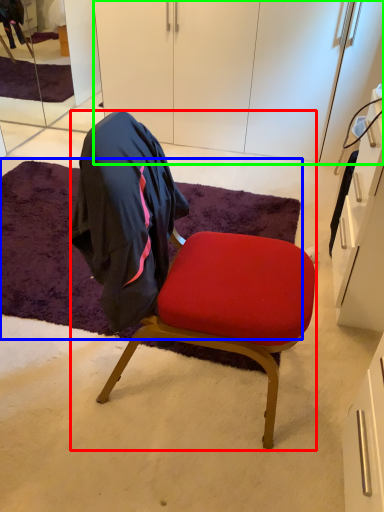
Question: Based on their relative distances, which object is nearer to chair (highlighted by a red box)? Choose from mat (highlighted by a blue box) and cabinetry (highlighted by a green box).

Choices:
 (A) mat
 (B) cabinetry

Answer: (A)